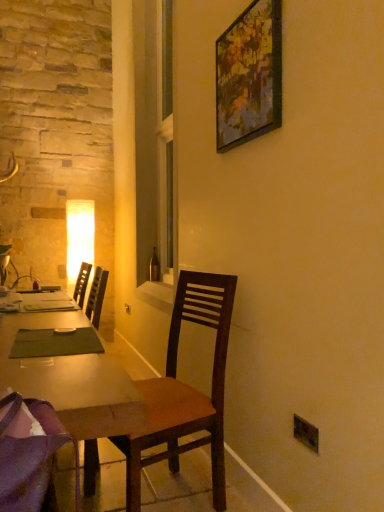
Measure the distance between wooden desk at center and camera.

wooden desk at center is 37.81 inches from camera.

How much space does purple fabric chair at lower left, which is the first chair from front to back, occupy horizontally?

purple fabric chair at lower left, which is the first chair from front to back, is 16.14 inches wide.

In order to face purple fabric chair at lower left, which ranks as the 2th chair in back-to-front order, should I rotate leftwards or rightwards?

Turn left approximately 20.794 degrees to face it.

This screenshot has width=384, height=512. What do you see at coordinates (154, 267) in the screenshot?
I see `brown glass bottle at center` at bounding box center [154, 267].

The width and height of the screenshot is (384, 512). In order to click on wooden desk at center in this screenshot , I will do `click(73, 385)`.

Is wooden picture frame at upper center completely or partially outside of wooden chair at center, the second chair viewed from the front?

Absolutely, wooden picture frame at upper center is external to wooden chair at center, the second chair viewed from the front.

From a real-world perspective, is wooden picture frame at upper center located beneath wooden chair at center, the second chair viewed from the front?

No.

Considering the relative positions of wooden picture frame at upper center and wooden chair at center, the second chair viewed from the front, in the image provided, is wooden picture frame at upper center in front of wooden chair at center, the second chair viewed from the front,?

No, wooden picture frame at upper center is further to the viewer.

In terms of width, does wooden picture frame at upper center look wider or thinner when compared to wooden chair at center, the second chair viewed from the front?

Clearly, wooden picture frame at upper center has less width compared to wooden chair at center, the second chair viewed from the front.

Considering the relative sizes of brown glass bottle at center and clear glass window at center in the image provided, is brown glass bottle at center thinner than clear glass window at center?

Yes.

From the picture: From the image's perspective, relative to clear glass window at center, is brown glass bottle at center above or below?

Clearly, from the image's perspective, brown glass bottle at center is below clear glass window at center.

Considering the relative sizes of brown glass bottle at center and clear glass window at center in the image provided, is brown glass bottle at center smaller than clear glass window at center?

Yes, brown glass bottle at center is smaller than clear glass window at center.

Is brown glass bottle at center closer to camera compared to clear glass window at center?

No, brown glass bottle at center is further to the viewer.

From a real-world perspective, which is physically below, wooden chair at center, the second chair viewed from the front, or clear glass window at center?

wooden chair at center, the second chair viewed from the front, from a real-world perspective.

Is wooden chair at center, the second chair viewed from the front, at the left side of clear glass window at center?

No.

From the image's perspective, is wooden chair at center, the first chair viewed from the back, positioned above or below clear glass window at center?

wooden chair at center, the first chair viewed from the back, is situated lower than clear glass window at center in the image.

Based on the photo, is brown glass bottle at center turned away from wooden desk at center?

No, brown glass bottle at center is not facing away from wooden desk at center.

Is brown glass bottle at center beside wooden desk at center?

No.

Considering the relative sizes of brown glass bottle at center and wooden desk at center in the image provided, is brown glass bottle at center smaller than wooden desk at center?

Yes.

Looking at this image, is brown glass bottle at center closer to the viewer compared to wooden desk at center?

No, it is not.

Which is correct: purple fabric chair at lower left, which is the first chair from front to back, is inside brown glass bottle at center, or outside of it?

purple fabric chair at lower left, which is the first chair from front to back, is spatially situated outside brown glass bottle at center.

Consider the image. Is there a large distance between purple fabric chair at lower left, which ranks as the 2th chair in back-to-front order, and brown glass bottle at center?

purple fabric chair at lower left, which ranks as the 2th chair in back-to-front order, is far away from brown glass bottle at center.

How different are the orientations of purple fabric chair at lower left, which is the first chair from front to back, and brown glass bottle at center in degrees?

91.1 degrees.

Is purple fabric chair at lower left, which is the first chair from front to back, aimed at brown glass bottle at center?

No.

Is the position of wooden desk at center more distant than that of purple fabric chair at lower left, which is the first chair from front to back?

That is True.

In terms of size, does wooden desk at center appear bigger or smaller than purple fabric chair at lower left, which ranks as the 2th chair in back-to-front order?

In the image, wooden desk at center appears to be larger than purple fabric chair at lower left, which ranks as the 2th chair in back-to-front order.

The image size is (384, 512). Identify the location of chair in front of the wooden desk at center. (31, 455).

Can you see wooden desk at center touching purple fabric chair at lower left, which ranks as the 2th chair in back-to-front order?

No, wooden desk at center is not in contact with purple fabric chair at lower left, which ranks as the 2th chair in back-to-front order.

Can you confirm if wooden chair at center, the second chair viewed from the front, is positioned to the left of black plastic power outlet at lower right?

No, wooden chair at center, the second chair viewed from the front, is not to the left of black plastic power outlet at lower right.

In terms of width, does wooden chair at center, the first chair viewed from the back, look wider or thinner when compared to black plastic power outlet at lower right?

Clearly, wooden chair at center, the first chair viewed from the back, has more width compared to black plastic power outlet at lower right.

Is wooden chair at center, the first chair viewed from the back, taller than black plastic power outlet at lower right?

Yes.

Where is `picture frame lying on the right of wooden chair at center, the second chair viewed from the front`? picture frame lying on the right of wooden chair at center, the second chair viewed from the front is located at coordinates (249, 75).

Locate an element on the screen. The height and width of the screenshot is (512, 384). bottle below the clear glass window at center (from a real-world perspective) is located at coordinates (x=154, y=267).

Looking at the image, which one is located closer to black plastic power outlet at lower right, wooden chair at center, the second chair viewed from the front, or purple fabric chair at lower left, which is the first chair from front to back?

The object closer to black plastic power outlet at lower right is wooden chair at center, the second chair viewed from the front.

Considering their positions, is wooden picture frame at upper center positioned closer to purple fabric chair at lower left, which is the first chair from front to back, than wooden desk at center?

wooden desk at center is positioned closer to the anchor purple fabric chair at lower left, which is the first chair from front to back.

When comparing their distances from wooden desk at center, does wooden picture frame at upper center or wooden chair at center, the second chair viewed from the front, seem closer?

Based on the image, wooden chair at center, the second chair viewed from the front, appears to be nearer to wooden desk at center.

Estimate the real-world distances between objects in this image. Which object is further from wooden chair at center, the first chair viewed from the back, purple fabric chair at lower left, which ranks as the 2th chair in back-to-front order, or brown glass bottle at center?

brown glass bottle at center is positioned further to the anchor wooden chair at center, the first chair viewed from the back.

Based on their spatial positions, is wooden picture frame at upper center or purple fabric chair at lower left, which ranks as the 2th chair in back-to-front order, further from brown glass bottle at center?

Based on the image, purple fabric chair at lower left, which ranks as the 2th chair in back-to-front order, appears to be further to brown glass bottle at center.

Based on their spatial positions, is wooden picture frame at upper center or wooden chair at center, the second chair viewed from the front, further from clear glass window at center?

wooden chair at center, the second chair viewed from the front, is further to clear glass window at center.

Which object lies nearer to the anchor point clear glass window at center, wooden chair at center, the second chair viewed from the front, or black plastic power outlet at lower right?

Among the two, wooden chair at center, the second chair viewed from the front, is located nearer to clear glass window at center.

Which object lies nearer to the anchor point wooden desk at center, purple fabric chair at lower left, which is the first chair from front to back, or black plastic power outlet at lower right?

purple fabric chair at lower left, which is the first chair from front to back, lies closer to wooden desk at center than the other object.

This screenshot has height=512, width=384. In order to click on bottle that lies between clear glass window at center and black plastic power outlet at lower right from top to bottom in this screenshot , I will do `click(154, 267)`.

Where is `window located between wooden picture frame at upper center and brown glass bottle at center in the depth direction`? window located between wooden picture frame at upper center and brown glass bottle at center in the depth direction is located at coordinates point(165,138).

This screenshot has width=384, height=512. I want to click on picture frame located between wooden chair at center, the second chair viewed from the front, and clear glass window at center in the depth direction, so click(x=249, y=75).

Find the location of a particular element. The image size is (384, 512). picture frame between wooden desk at center and clear glass window at center along the z-axis is located at coordinates (249, 75).